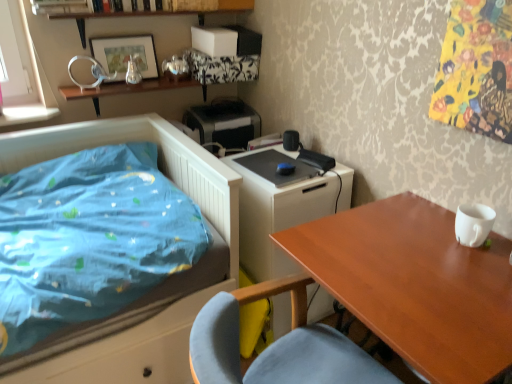
Question: Can we say blue fabric bed at left lies outside metallic silver picture frame at upper left?

Choices:
 (A) yes
 (B) no

Answer: (A)

Question: Can you confirm if blue fabric bed at left is taller than metallic silver picture frame at upper left?

Choices:
 (A) yes
 (B) no

Answer: (A)

Question: Does blue fabric bed at left lie behind metallic silver picture frame at upper left?

Choices:
 (A) yes
 (B) no

Answer: (B)

Question: Is metallic silver picture frame at upper left a part of blue fabric bed at left?

Choices:
 (A) yes
 (B) no

Answer: (B)

Question: Is blue fabric bed at left not near metallic silver picture frame at upper left?

Choices:
 (A) no
 (B) yes

Answer: (A)

Question: Is point (272, 226) closer or farther from the camera than point (51, 364)?

Choices:
 (A) farther
 (B) closer

Answer: (A)

Question: Would you say white glossy changing table at center is to the left or to the right of blue fabric bed at left in the picture?

Choices:
 (A) left
 (B) right

Answer: (B)

Question: In terms of size, does white glossy changing table at center appear bigger or smaller than blue fabric bed at left?

Choices:
 (A) big
 (B) small

Answer: (B)

Question: From the image's perspective, relative to blue fabric bed at left, is white glossy changing table at center above or below?

Choices:
 (A) below
 (B) above

Answer: (B)

Question: In the image, is black plastic printer at upper center on the left side or the right side of blue fabric bed at left?

Choices:
 (A) right
 (B) left

Answer: (A)

Question: Relative to blue fabric bed at left, is black plastic printer at upper center in front or behind?

Choices:
 (A) behind
 (B) front

Answer: (A)

Question: Looking at their shapes, would you say black plastic printer at upper center is wider or thinner than blue fabric bed at left?

Choices:
 (A) wide
 (B) thin

Answer: (B)

Question: Based on their sizes in the image, would you say black plastic printer at upper center is bigger or smaller than blue fabric bed at left?

Choices:
 (A) small
 (B) big

Answer: (A)

Question: Is point (425, 274) positioned closer to the camera than point (201, 117)?

Choices:
 (A) farther
 (B) closer

Answer: (B)

Question: Would you say wooden table at right is to the left or to the right of black plastic printer at upper center in the picture?

Choices:
 (A) right
 (B) left

Answer: (A)